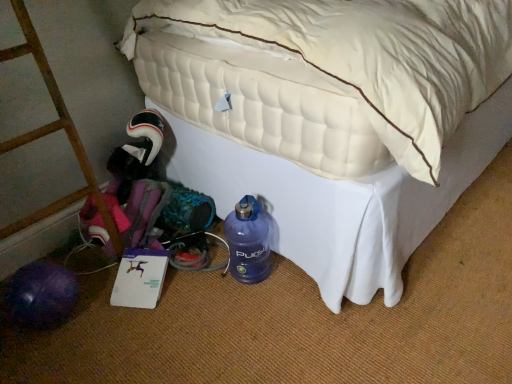
The image size is (512, 384). Identify the location of spots to the right of blue matte water bottle at lower center. (292, 276).